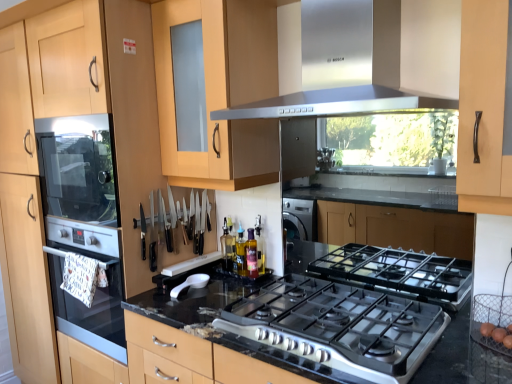
Locate an element on the screen. The width and height of the screenshot is (512, 384). free space in front of translucent glass bottle at center, which ranks as the second bottle in left-to-right order is located at coordinates (243, 289).